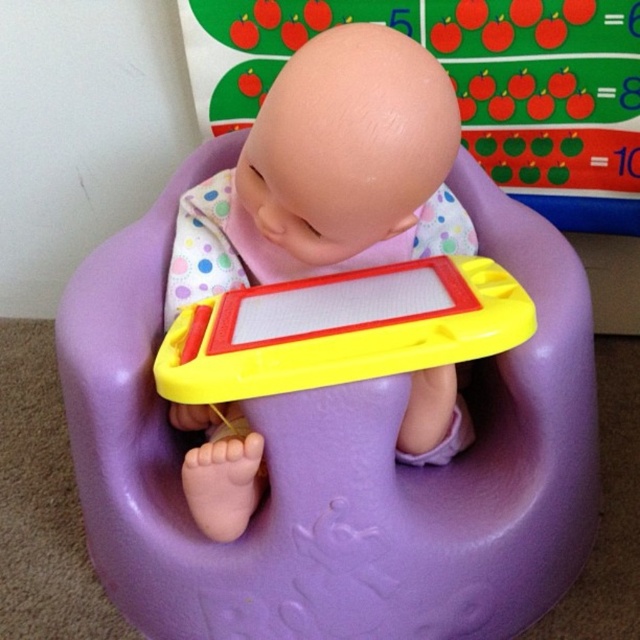
Question: Which point is farther to the camera?

Choices:
 (A) purple plastic feeding chair at center
 (B) yellow plastic toy at center

Answer: (A)

Question: Among these points, which one is nearest to the camera?

Choices:
 (A) (260, 212)
 (B) (154, 580)
 (C) (470, 349)

Answer: (C)

Question: Estimate the real-world distances between objects in this image. Which object is closer to the purple plastic feeding chair at center?

Choices:
 (A) yellow plastic toy at center
 (B) matte plastic baby at center

Answer: (B)

Question: Can you confirm if matte plastic baby at center is wider than yellow plastic toy at center?

Choices:
 (A) yes
 (B) no

Answer: (A)

Question: Does purple plastic feeding chair at center appear over yellow plastic toy at center?

Choices:
 (A) no
 (B) yes

Answer: (A)

Question: Is purple plastic feeding chair at center thinner than yellow plastic toy at center?

Choices:
 (A) yes
 (B) no

Answer: (B)